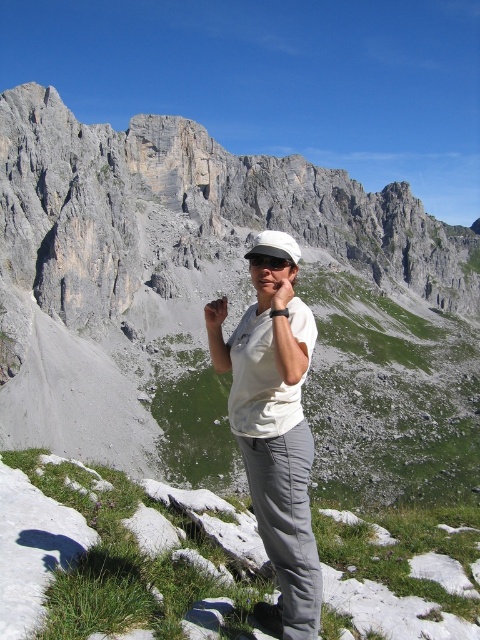
You are a drone operator trying to capture a photo of the person in the mountainous landscape. The drone is currently positioned at point 0.386, 0.573. To avoid capturing the white matte baseball cap at center in the photo, where should you adjust the drone to move? Please provide coordinates in the format of a point with two decimal places.

The white matte baseball cap at center is located at point (275, 246). To avoid capturing it, move the drone to a position slightly away from this point, such as (288, 256).

You are a photographer trying to capture the perfect shot of the mountain landscape. You notice two points in the scene at coordinates point (271, 374) and point (219, 321). Which point is positioned closer to your camera lens?

Point (271, 374) is closer to the camera than point (219, 321).

You are a drone operator tasked with capturing a closeup shot of the brown leather hand at center and the black matte goggles at center. The drone has a minimum safe distance of 25 meters to avoid disturbing the subject. Can you safely capture both items from the same position without violating the minimum distance requirement?

The distance between the brown leather hand at center and the black matte goggles at center is 27.27 meters. Since this distance is greater than the drone minimum safe distance of 25 meters, the drone can safely capture both items from the same position without violating the minimum distance requirement.